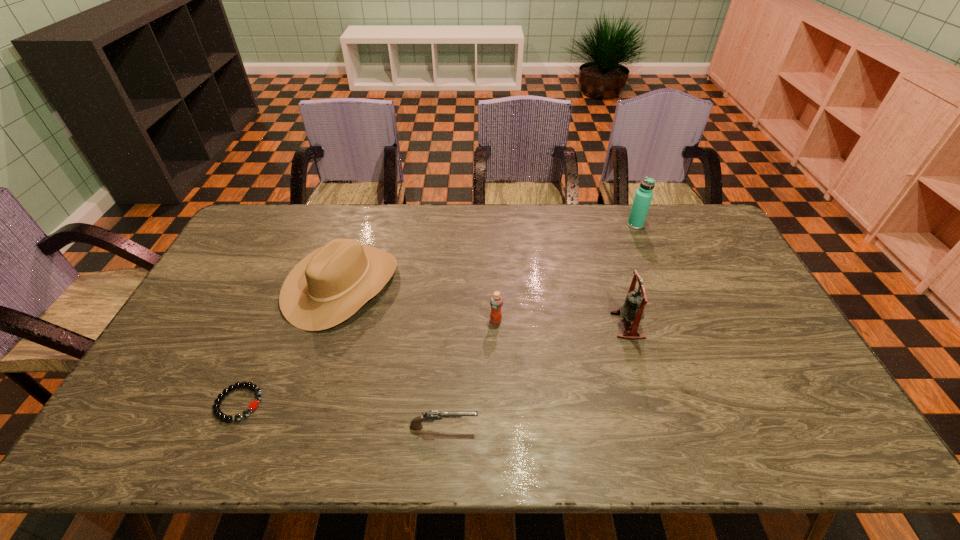
You are a GUI agent. You are given a task and a screenshot of the screen. Output one action in this format:
    pyautogui.click(x=<x>, y=<y>)
    Task: Click on the vacant space at the left edge of the desktop
    
    Given the screenshot: What is the action you would take?
    pyautogui.click(x=214, y=354)

Image resolution: width=960 pixels, height=540 pixels. In order to click on free space at the right edge in this screenshot , I will do `click(728, 280)`.

In the image, there is a desktop. Where is `free space at the far right corner`? free space at the far right corner is located at coordinates (707, 227).

Identify the location of vacant space in between the bracelet and the fifth object from left to right. (433, 364).

Find the location of `free space that is in between the shortest object and the orange juice`. free space that is in between the shortest object and the orange juice is located at coordinates (368, 362).

Identify the location of vacant region between the second shortest object and the shortest object. The image size is (960, 540). (342, 415).

Where is `vacant area between the thermos bottle and the third object from right to left`? vacant area between the thermos bottle and the third object from right to left is located at coordinates (565, 272).

In order to click on vacant space in between the gun and the cowboy hat in this screenshot , I will do `click(393, 356)`.

In order to click on vacant space in between the rightmost object and the orange juice in this screenshot , I will do `click(565, 272)`.

This screenshot has width=960, height=540. Find the location of `free space between the shortest object and the orange juice`. free space between the shortest object and the orange juice is located at coordinates (368, 362).